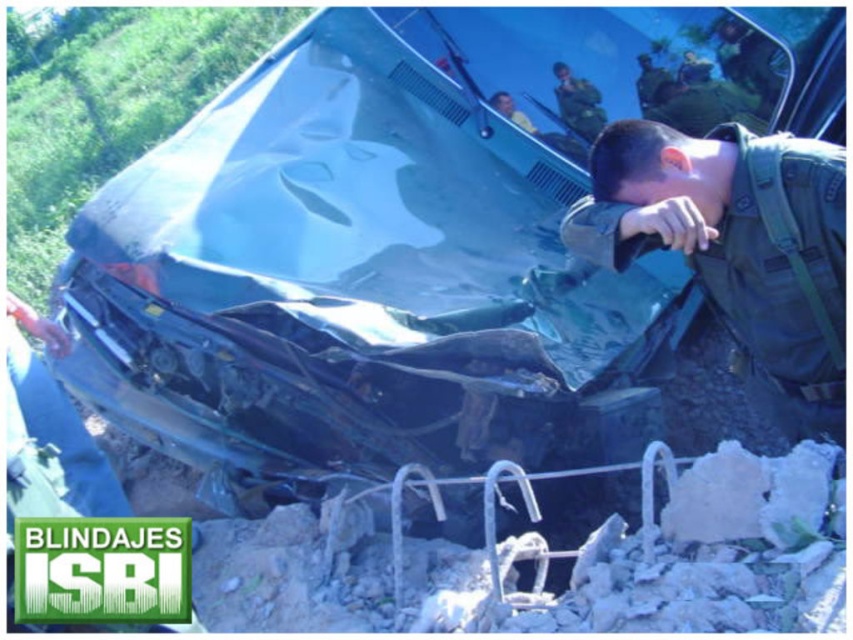
Question: Which object appears farthest from the camera in this image?

Choices:
 (A) green matte uniform at upper center
 (B) glossy glass windshield at upper center
 (C) dark green uniform at center

Answer: (A)

Question: Where is dark green uniform at center located in relation to green matte uniform at upper center in the image?

Choices:
 (A) left
 (B) right

Answer: (B)

Question: Does glossy glass windshield at upper center have a greater width compared to green matte uniform at upper center?

Choices:
 (A) no
 (B) yes

Answer: (B)

Question: Estimate the real-world distances between objects in this image. Which object is closer to the glossy glass windshield at upper center?

Choices:
 (A) dark green uniform at center
 (B) green matte uniform at upper center

Answer: (B)

Question: Which object is the closest to the dark green uniform at center?

Choices:
 (A) green matte uniform at upper center
 (B) glossy glass windshield at upper center

Answer: (B)

Question: Where is dark green uniform at center located in relation to glossy glass windshield at upper center in the image?

Choices:
 (A) right
 (B) left

Answer: (A)